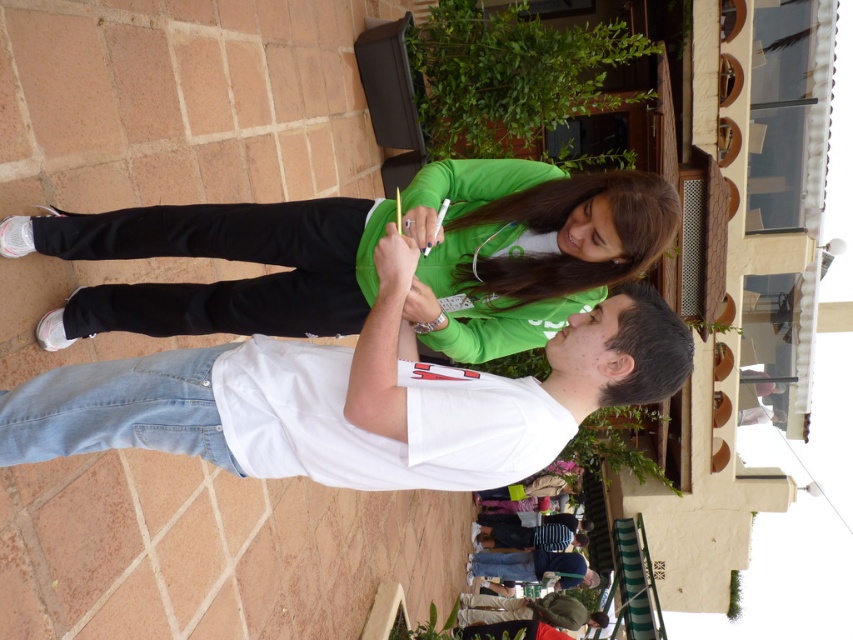
Question: Does white denim jeans at center appear over green matte shirt at center?

Choices:
 (A) yes
 (B) no

Answer: (B)

Question: From the image, what is the correct spatial relationship of white denim jeans at center in relation to green matte shirt at center?

Choices:
 (A) right
 (B) left

Answer: (B)

Question: Which point appears farthest from the camera in this image?

Choices:
 (A) (403, 259)
 (B) (57, 344)

Answer: (B)

Question: Does white denim jeans at center have a greater width compared to green matte shirt at center?

Choices:
 (A) no
 (B) yes

Answer: (A)

Question: Which object appears closest to the camera in this image?

Choices:
 (A) white denim jeans at center
 (B) green matte shirt at center

Answer: (A)